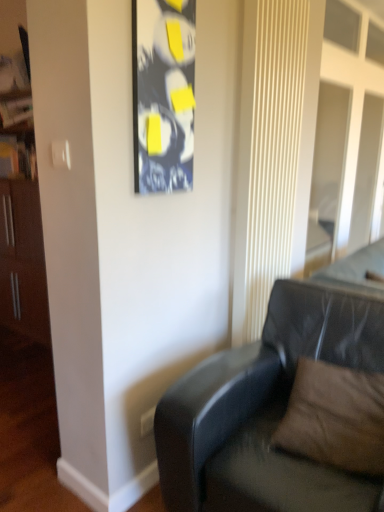
What do you see at coordinates (266, 411) in the screenshot? I see `black leather couch at lower right` at bounding box center [266, 411].

What is the approximate width of black leather couch at lower right?

black leather couch at lower right is 3.38 feet in width.

Find the location of a particular element. The width and height of the screenshot is (384, 512). brown suede pillow at lower right is located at coordinates (335, 418).

Which object is further away from the camera taking this photo, black leather couch at lower right or brown suede pillow at lower right?

brown suede pillow at lower right is more distant.

From a real-world perspective, relative to brown suede pillow at lower right, is black leather couch at lower right vertically above or below?

In terms of real-world spatial position, black leather couch at lower right is below brown suede pillow at lower right.

How different are the orientations of black leather couch at lower right and brown suede pillow at lower right in degrees?

5.37 degrees.

From the image's perspective, is black leather couch at lower right under brown suede pillow at lower right?

Correct, black leather couch at lower right appears lower than brown suede pillow at lower right in the image.

Looking at the image, does brown suede pillow at lower right seem bigger or smaller compared to black glossy picture frame at upper center?

In the image, brown suede pillow at lower right appears to be larger than black glossy picture frame at upper center.

Which is more to the right, brown suede pillow at lower right or black glossy picture frame at upper center?

Positioned to the right is brown suede pillow at lower right.

Which point is more distant from viewer, [332,394] or [161,94]?

Positioned behind is point [332,394].

Identify the location of picture frame above the brown suede pillow at lower right (from a real-world perspective). (163, 94).

Can you see black glossy picture frame at upper center touching black leather couch at lower right?

No.

I want to click on picture frame on the left of black leather couch at lower right, so click(x=163, y=94).

Is black glossy picture frame at upper center thinner than black leather couch at lower right?

Indeed, black glossy picture frame at upper center has a lesser width compared to black leather couch at lower right.

From the image's perspective, is black glossy picture frame at upper center located beneath black leather couch at lower right?

No, from the image's perspective, black glossy picture frame at upper center is not below black leather couch at lower right.

Considering the sizes of objects black leather couch at lower right and black glossy picture frame at upper center in the image provided, who is thinner, black leather couch at lower right or black glossy picture frame at upper center?

With smaller width is black glossy picture frame at upper center.

Is black leather couch at lower right surrounding black glossy picture frame at upper center?

Definitely not — black glossy picture frame at upper center is not inside black leather couch at lower right.

Which of these two, black leather couch at lower right or black glossy picture frame at upper center, is bigger?

Bigger between the two is black leather couch at lower right.

Does black glossy picture frame at upper center have a greater width compared to brown suede pillow at lower right?

Incorrect, the width of black glossy picture frame at upper center does not surpass that of brown suede pillow at lower right.

From the image's perspective, who appears lower, black glossy picture frame at upper center or brown suede pillow at lower right?

brown suede pillow at lower right, from the image's perspective.

Based on the photo, is the position of black glossy picture frame at upper center less distant than that of brown suede pillow at lower right?

That is False.

In the scene shown: Which of these two, brown suede pillow at lower right or black leather couch at lower right, is wider?

With larger width is black leather couch at lower right.

How many degrees apart are the facing directions of brown suede pillow at lower right and black leather couch at lower right?

The angular difference between brown suede pillow at lower right and black leather couch at lower right is 5.37 degrees.

From the picture: Does brown suede pillow at lower right turn towards black leather couch at lower right?

Yes, brown suede pillow at lower right is aimed at black leather couch at lower right.

The image size is (384, 512). Find the location of `pillow behind the black leather couch at lower right`. pillow behind the black leather couch at lower right is located at coordinates (335, 418).

At what (x,y) coordinates should I click in order to perform the action: click on picture frame on the left side of brown suede pillow at lower right. Please return your answer as a coordinate pair (x, y). This screenshot has width=384, height=512. Looking at the image, I should click on (163, 94).

Which object lies further to the anchor point black glossy picture frame at upper center, brown suede pillow at lower right or black leather couch at lower right?

brown suede pillow at lower right.

Estimate the real-world distances between objects in this image. Which object is further from black leather couch at lower right, black glossy picture frame at upper center or brown suede pillow at lower right?

black glossy picture frame at upper center is further to black leather couch at lower right.

Looking at the image, which one is located closer to black leather couch at lower right, brown suede pillow at lower right or black glossy picture frame at upper center?

Based on the image, brown suede pillow at lower right appears to be nearer to black leather couch at lower right.

Looking at the image, which one is located further to brown suede pillow at lower right, black leather couch at lower right or black glossy picture frame at upper center?

black glossy picture frame at upper center lies further to brown suede pillow at lower right than the other object.

From the image, which object appears to be nearer to brown suede pillow at lower right, black glossy picture frame at upper center or black leather couch at lower right?

Based on the image, black leather couch at lower right appears to be nearer to brown suede pillow at lower right.

Estimate the real-world distances between objects in this image. Which object is closer to black glossy picture frame at upper center, black leather couch at lower right or brown suede pillow at lower right?

Among the two, black leather couch at lower right is located nearer to black glossy picture frame at upper center.

In order to click on pillow between black glossy picture frame at upper center and black leather couch at lower right from top to bottom in this screenshot , I will do `click(335, 418)`.